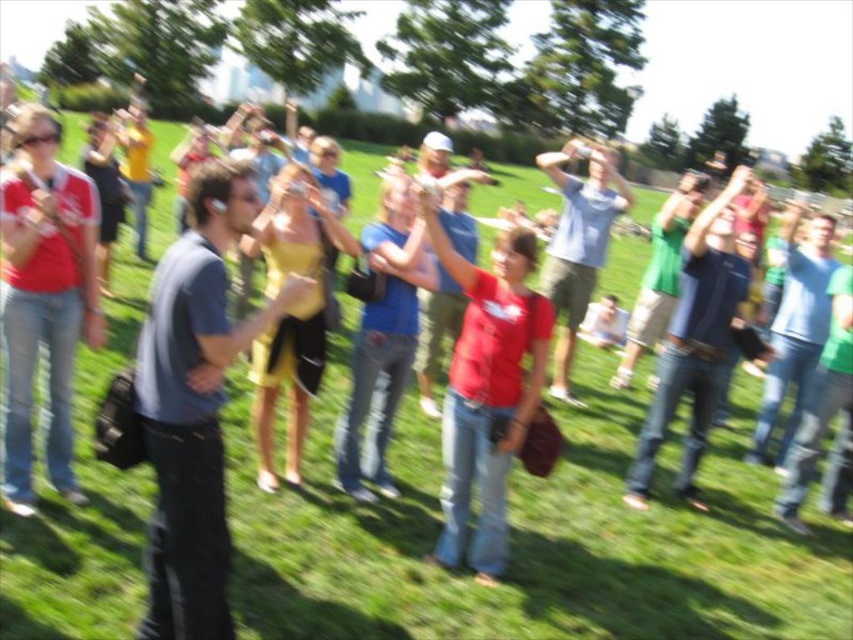
You are a photographer at the park event and want to capture a photo of both the matte red shirt at center and the yellow satin dress at center. Since you can only focus on one subject at a time, which one should you focus on first to ensure the other is still in the frame?

The matte red shirt at center is located below the yellow satin dress at center, so you should focus on the yellow satin dress at center first. This way, the lower positioned matte red shirt at center will remain within the frame.

You are a photographer positioned at the back of the scene. You want to take a photo that includes both the matte red shirt at left and the yellow satin dress at center. Which object should you focus on first to ensure both are in sharp focus?

The matte red shirt at left is closer to the viewer than the yellow satin dress at center. To ensure both are in sharp focus, you should focus on the matte red shirt at left first, as it is closer, and the yellow satin dress at center will fall within the depth of field if properly adjusted.

You are a photographer at this event and want to ensure both the dark gray shirt at center and the yellow satin dress at center are fully visible in your photo. Which object should you focus on to frame the shot properly?

The dark gray shirt at center is not as tall as the yellow satin dress at center, so you should focus on the yellow satin dress at center to ensure both are fully visible in the photo.